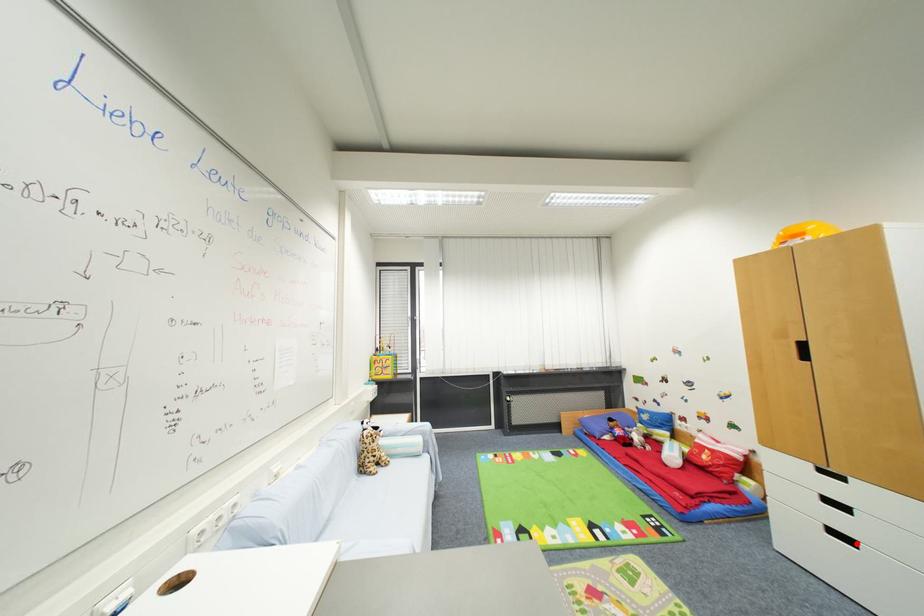
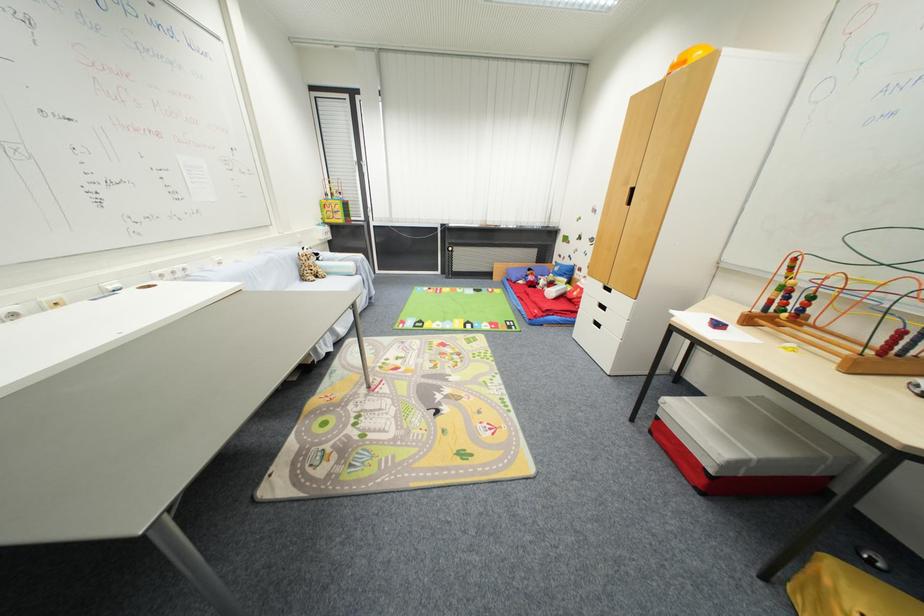
Where in the second image is the point corresponding to the highlighted location from the first image?

(604, 328)